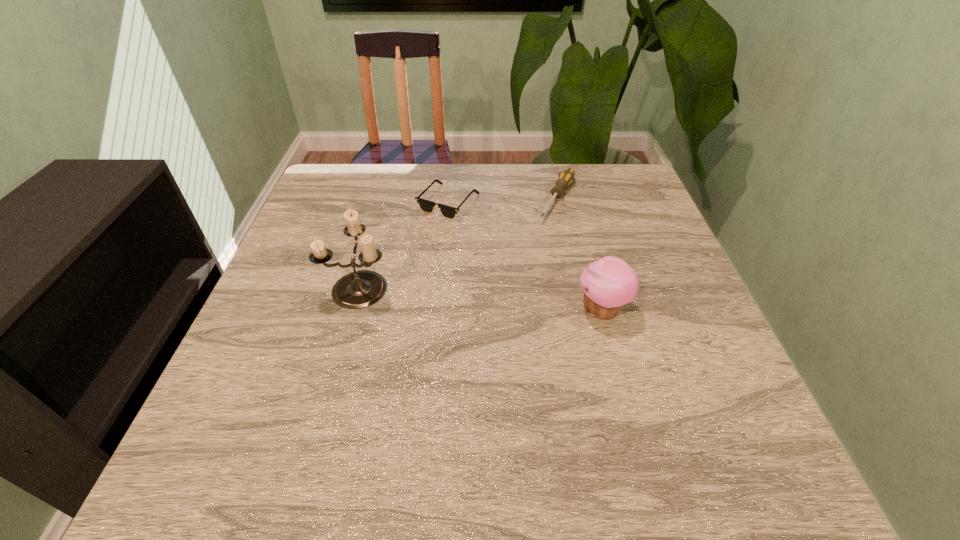
This screenshot has height=540, width=960. I want to click on the tallest object, so click(359, 289).

Find the location of `candle holder`. candle holder is located at coordinates (359, 289).

The image size is (960, 540). I want to click on cupcake, so click(x=609, y=283).

Identify the location of the second shortest object. (565, 178).

Where is `the shortest object`? This screenshot has width=960, height=540. the shortest object is located at coordinates (427, 206).

Image resolution: width=960 pixels, height=540 pixels. In order to click on the second object from left to right in this screenshot , I will do `click(427, 206)`.

Locate an element on the screen. The image size is (960, 540). vacant space situated on the right of the candle holder is located at coordinates (479, 286).

Identify the location of vacant space positioned 0.090m on the left of the cupcake. The height and width of the screenshot is (540, 960). (532, 310).

Locate an element on the screen. blank space located 0.290m at the tip of the screwdriver is located at coordinates (509, 295).

Locate an element on the screen. This screenshot has width=960, height=540. vacant area located at the tip of the screwdriver is located at coordinates (531, 259).